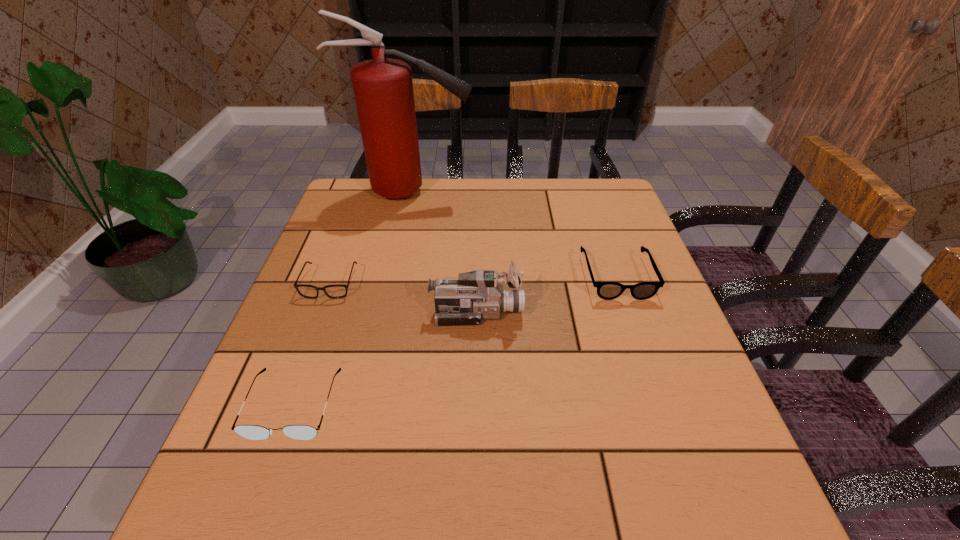
Find the location of a particular element. Image resolution: width=960 pixels, height=540 pixels. the tallest object is located at coordinates (383, 88).

I want to click on the farthest object, so click(x=383, y=88).

I want to click on the second tallest object, so click(475, 295).

Where is `the rightmost object`? Image resolution: width=960 pixels, height=540 pixels. the rightmost object is located at coordinates (606, 290).

Find the location of a particular element. This screenshot has width=960, height=540. the nearest spectacles is located at coordinates (253, 432).

You are a GUI agent. You are given a task and a screenshot of the screen. Output one action in this format:
    pyautogui.click(x=<x>, y=<y>)
    Task: Click on the shortest spectacles
    This screenshot has width=960, height=540.
    Given the screenshot: What is the action you would take?
    pyautogui.click(x=337, y=291)

Locate an element on the screen. This screenshot has height=540, width=960. free space located 0.130m at the nozzle of the fire extinguisher is located at coordinates (516, 192).

Locate an element on the screen. free space located 0.080m on the front-facing side of the camcorder is located at coordinates (559, 312).

Where is `free space located on the arms of the rightmost object`? Image resolution: width=960 pixels, height=540 pixels. free space located on the arms of the rightmost object is located at coordinates (651, 376).

In order to click on free space located 0.080m on the lenses of the nearest spectacles in this screenshot , I will do `click(263, 490)`.